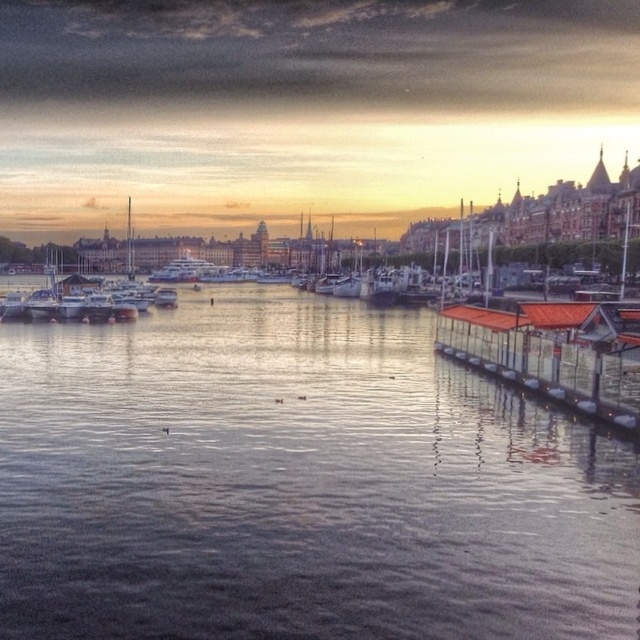
Image resolution: width=640 pixels, height=640 pixels. What do you see at coordinates (298, 483) in the screenshot?
I see `smooth water at center` at bounding box center [298, 483].

Is smooth water at center below orange corrugated metal dock at lower right?

Yes, smooth water at center is below orange corrugated metal dock at lower right.

Locate an element on the screen. smooth water at center is located at coordinates (298, 483).

Find the location of a particular element. The height and width of the screenshot is (640, 640). smooth water at center is located at coordinates pyautogui.click(x=298, y=483).